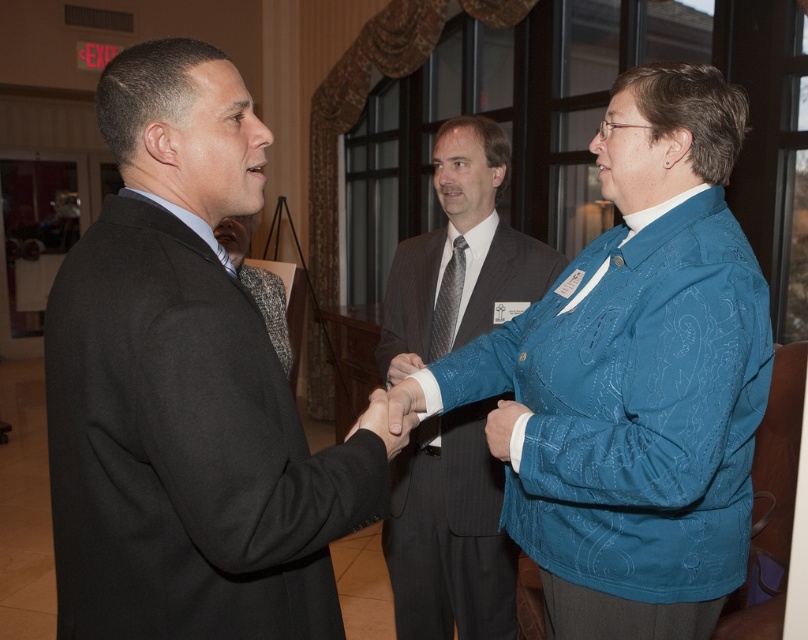
You are a photographer at a networking event. You want to take a photo of the two men shaking hands and the woman in the teal jacket. The matte black hand at center and blue fabric sleeve at center are in the frame. Which object should you focus on if you want to capture the wider subject?

The matte black hand at center is wider than the blue fabric sleeve at center, so you should focus on the matte black hand at center to capture the wider subject.

You are a tailor who needs to adjust the size of the gray tweed suit at center and the gray textured tie at center. Which item requires more fabric to enlarge its size?

The gray tweed suit at center requires more fabric to enlarge its size since it is bigger than the gray textured tie at center.

You are standing at the origin point of the coordinate system in the image. The gray tweed suit at center is located at point (257, 282). If you want to move directly towards the gray tweed suit at center, which direction should you move in?

Since the gray tweed suit at center is located at point (257, 282), you should move towards that coordinate to reach it directly.